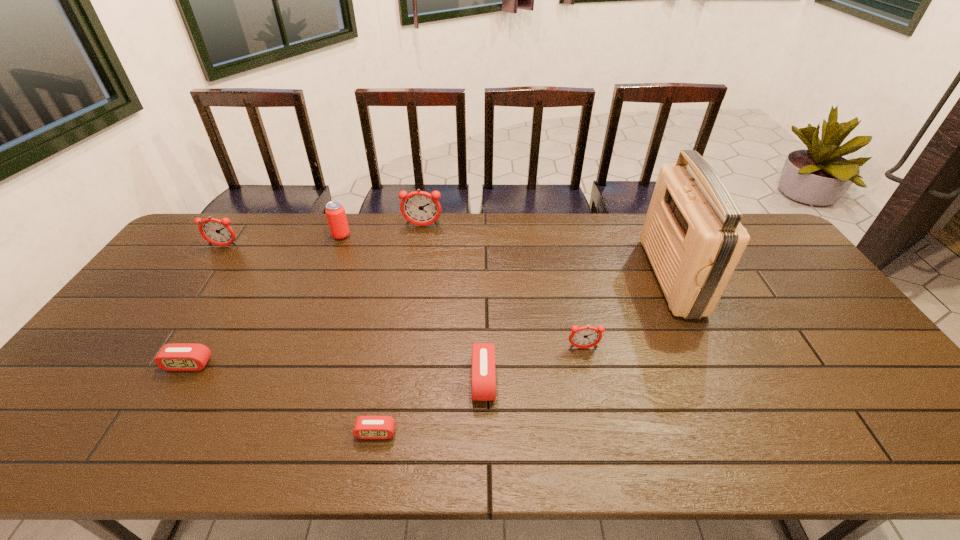
The image size is (960, 540). I want to click on the rightmost pink alarm clock, so click(483, 376).

At what (x,y) coordinates should I click in order to perform the action: click on the fourth tallest alarm clock. Please return your answer as a coordinate pair (x, y). Image resolution: width=960 pixels, height=540 pixels. Looking at the image, I should click on (483, 376).

You are a GUI agent. You are given a task and a screenshot of the screen. Output one action in this format:
    pyautogui.click(x=<x>, y=<y>)
    Task: Click on the leftmost pink alarm clock
    This screenshot has height=540, width=960.
    Given the screenshot: What is the action you would take?
    pyautogui.click(x=176, y=356)

Identify the location of the seventh tallest object. The width and height of the screenshot is (960, 540). (176, 356).

Find the location of `the shortest alarm clock`. the shortest alarm clock is located at coordinates (366, 427).

This screenshot has width=960, height=540. I want to click on the second pink alarm clock from right to left, so click(x=366, y=427).

Locate an element on the screen. vacant space situated 0.170m on the front-facing side of the rightmost object is located at coordinates (598, 276).

Locate an element on the screen. vacant space located 0.240m on the front-facing side of the rightmost object is located at coordinates (575, 276).

I want to click on vacant space located on the front-facing side of the rightmost object, so click(588, 276).

Find the location of a particular element. This screenshot has height=540, width=960. vacant space situated 0.260m on the front-facing side of the second reddish-pink alarm clock from right to left is located at coordinates (414, 277).